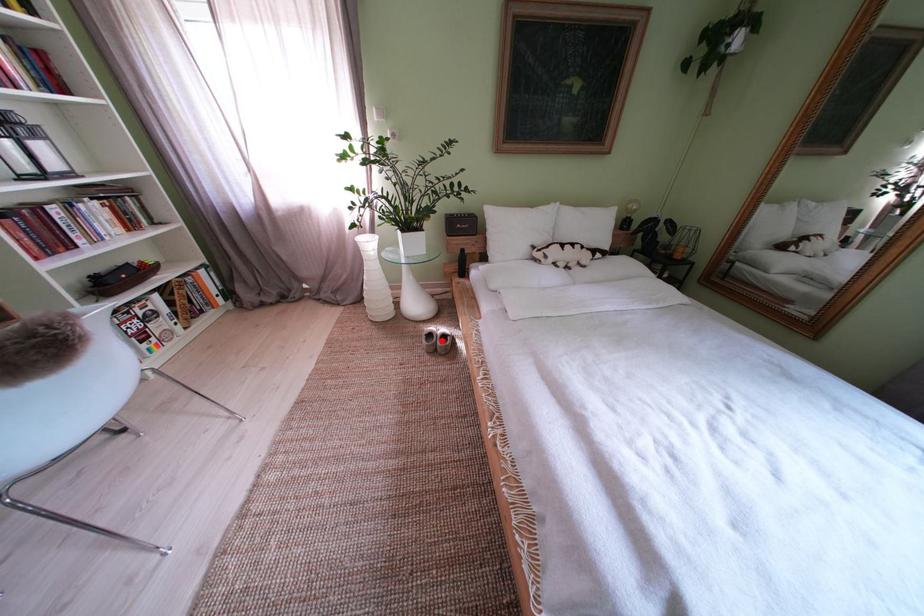
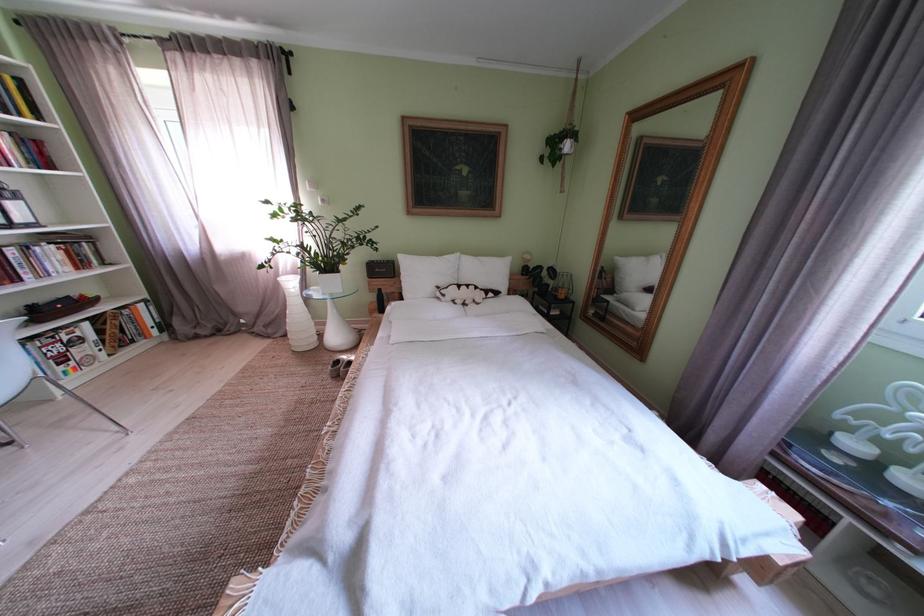
Question: I am providing you with two images of the same scene from different viewpoints. A red point is marked on the first image. Is the red point's position out of view in image 2?

Choices:
 (A) Yes
 (B) No

Answer: (B)